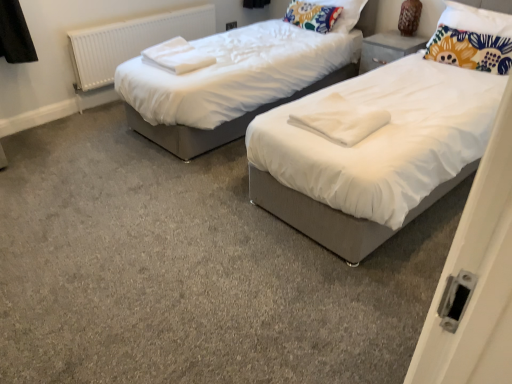
In order to click on vacant space situated above white plastic radiator at left (from a real-world perspective) in this screenshot , I will do coord(142,13).